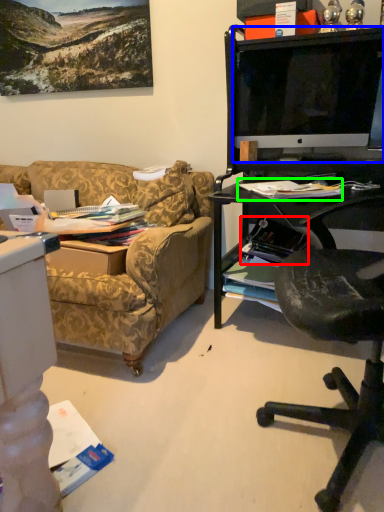
Question: Which is farther away from magazine (highlighted by a red box)? television (highlighted by a blue box) or magazine (highlighted by a green box)?

Choices:
 (A) television
 (B) magazine

Answer: (A)